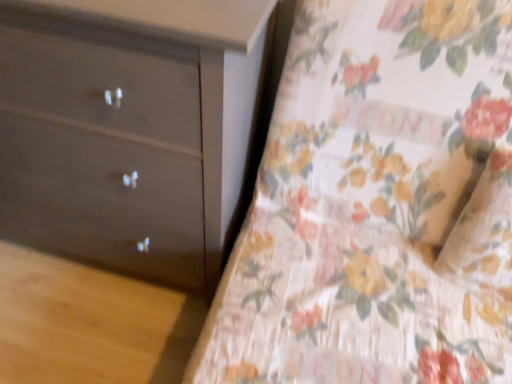
Question: Could you tell me if matte dark brown dresser at left is turned towards floral fabric bedspread at center?

Choices:
 (A) yes
 (B) no

Answer: (B)

Question: Is matte dark brown dresser at left not close to floral fabric bedspread at center?

Choices:
 (A) no
 (B) yes

Answer: (A)

Question: From a real-world perspective, is matte dark brown dresser at left on floral fabric bedspread at center?

Choices:
 (A) no
 (B) yes

Answer: (A)

Question: Is matte dark brown dresser at left at the left side of floral fabric bedspread at center?

Choices:
 (A) yes
 (B) no

Answer: (A)

Question: Does matte dark brown dresser at left have a greater width compared to floral fabric bedspread at center?

Choices:
 (A) no
 (B) yes

Answer: (A)

Question: Is floral fabric bedspread at center inside matte dark brown dresser at left?

Choices:
 (A) yes
 (B) no

Answer: (B)

Question: Is floral fabric bedspread at center looking in the opposite direction of matte dark brown dresser at left?

Choices:
 (A) no
 (B) yes

Answer: (A)

Question: Does floral fabric bedspread at center have a greater width compared to matte dark brown dresser at left?

Choices:
 (A) no
 (B) yes

Answer: (B)

Question: Is floral fabric bedspread at center aimed at matte dark brown dresser at left?

Choices:
 (A) yes
 (B) no

Answer: (B)

Question: Considering the relative sizes of floral fabric bedspread at center and matte dark brown dresser at left in the image provided, is floral fabric bedspread at center thinner than matte dark brown dresser at left?

Choices:
 (A) no
 (B) yes

Answer: (A)

Question: From a real-world perspective, does floral fabric bedspread at center sit lower than matte dark brown dresser at left?

Choices:
 (A) no
 (B) yes

Answer: (A)

Question: Can you confirm if floral fabric bedspread at center is taller than matte dark brown dresser at left?

Choices:
 (A) no
 (B) yes

Answer: (A)

Question: Is matte dark brown dresser at left inside or outside of floral fabric bedspread at center?

Choices:
 (A) outside
 (B) inside

Answer: (A)